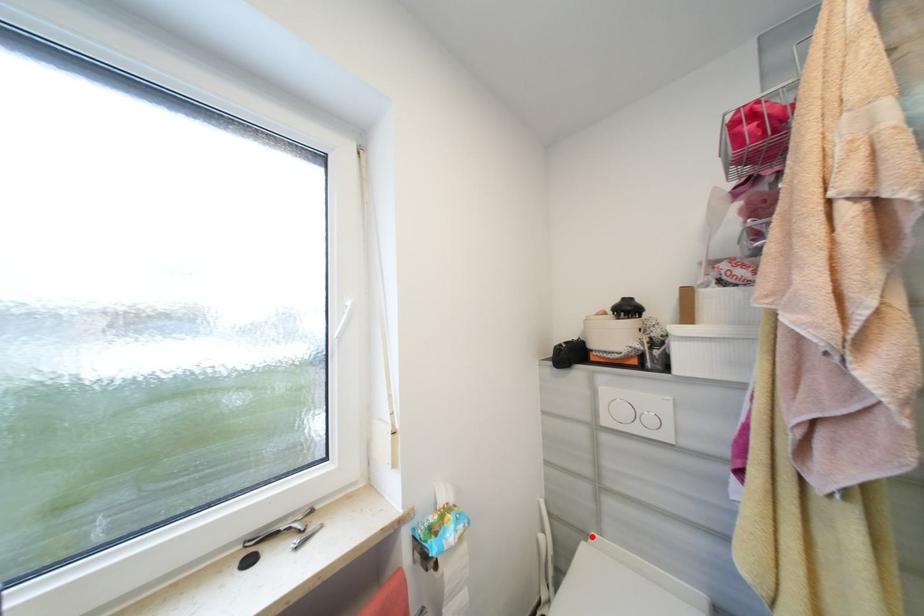
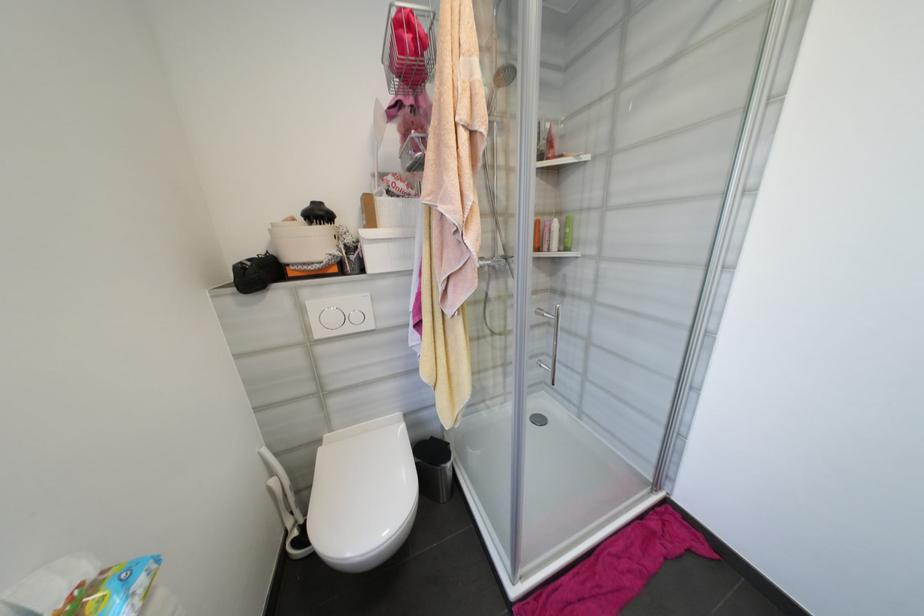
The point at the highlighted location is marked in the first image. Where is the corresponding point in the second image?

(325, 443)